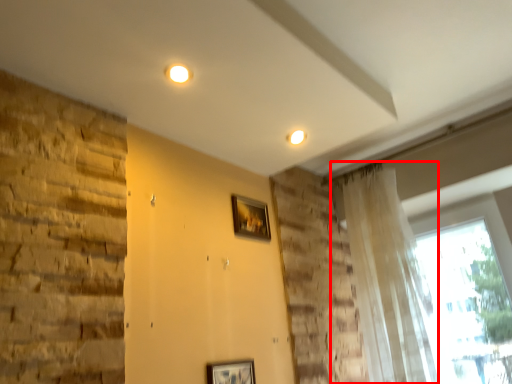
Question: Considering the relative positions of curtain (annotated by the red box) and picture frame in the image provided, where is curtain (annotated by the red box) located with respect to the staircase?

Choices:
 (A) right
 (B) left

Answer: (A)